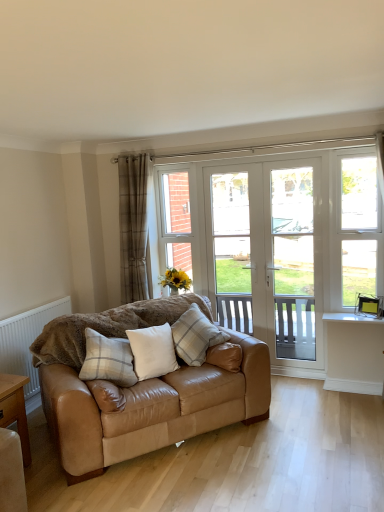
Question: Is there a large distance between white textured radiator at lower left and plaid fabric pillow at center, which is the 1th pillow in left-to-right order?

Choices:
 (A) yes
 (B) no

Answer: (B)

Question: From a real-world perspective, is white textured radiator at lower left under plaid fabric pillow at center, which is the 1th pillow in left-to-right order?

Choices:
 (A) yes
 (B) no

Answer: (A)

Question: From the image's perspective, is white textured radiator at lower left located beneath plaid fabric pillow at center, arranged as the third pillow when viewed from the right?

Choices:
 (A) yes
 (B) no

Answer: (B)

Question: Is white textured radiator at lower left shorter than plaid fabric pillow at center, arranged as the third pillow when viewed from the right?

Choices:
 (A) yes
 (B) no

Answer: (B)

Question: Can you see white textured radiator at lower left touching plaid fabric pillow at center, arranged as the third pillow when viewed from the right?

Choices:
 (A) yes
 (B) no

Answer: (B)

Question: Is white textured radiator at lower left at the left side of plaid fabric pillow at center, arranged as the third pillow when viewed from the right?

Choices:
 (A) no
 (B) yes

Answer: (B)

Question: From the image's perspective, is plaid fabric curtain at left above white leather pillow at center, positioned as the second pillow in right-to-left order?

Choices:
 (A) yes
 (B) no

Answer: (A)

Question: Can you confirm if plaid fabric curtain at left is taller than white leather pillow at center, positioned as the second pillow in right-to-left order?

Choices:
 (A) no
 (B) yes

Answer: (B)

Question: Is white leather pillow at center, positioned as the second pillow in right-to-left order, at the back of plaid fabric curtain at left?

Choices:
 (A) no
 (B) yes

Answer: (A)

Question: Can you confirm if plaid fabric curtain at left is positioned to the right of white leather pillow at center, positioned as the second pillow in right-to-left order?

Choices:
 (A) no
 (B) yes

Answer: (A)

Question: Considering the relative sizes of plaid fabric curtain at left and white leather pillow at center, the 2th pillow positioned from the left, in the image provided, is plaid fabric curtain at left bigger than white leather pillow at center, the 2th pillow positioned from the left,?

Choices:
 (A) yes
 (B) no

Answer: (A)

Question: From the image's perspective, is plaid fabric curtain at left beneath white leather pillow at center, the 2th pillow positioned from the left?

Choices:
 (A) yes
 (B) no

Answer: (B)

Question: Can you confirm if white plastic window at right is shorter than light brown wooden table at lower left?

Choices:
 (A) no
 (B) yes

Answer: (A)